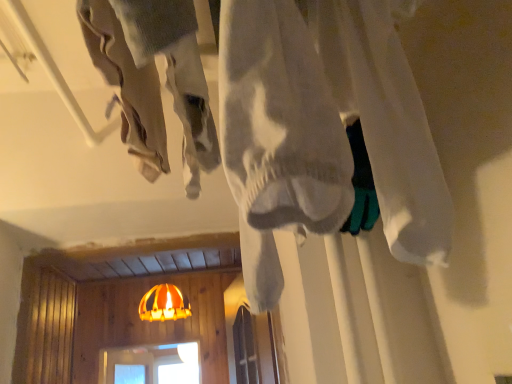
Question: Is orange fabric lampshade at center at the left side of white cotton shirt at center?

Choices:
 (A) yes
 (B) no

Answer: (A)

Question: Considering the relative sizes of orange fabric lampshade at center and white cotton shirt at center in the image provided, is orange fabric lampshade at center wider than white cotton shirt at center?

Choices:
 (A) no
 (B) yes

Answer: (B)

Question: Is orange fabric lampshade at center smaller than white cotton shirt at center?

Choices:
 (A) yes
 (B) no

Answer: (B)

Question: Is orange fabric lampshade at center to the right of white cotton shirt at center from the viewer's perspective?

Choices:
 (A) no
 (B) yes

Answer: (A)

Question: Considering the relative sizes of orange fabric lampshade at center and white cotton shirt at center in the image provided, is orange fabric lampshade at center bigger than white cotton shirt at center?

Choices:
 (A) no
 (B) yes

Answer: (B)

Question: Is orange fabric lampshade at center aimed at white cotton shirt at center?

Choices:
 (A) no
 (B) yes

Answer: (B)

Question: Is white cotton shirt at center oriented away from orange fabric lampshade at center?

Choices:
 (A) no
 (B) yes

Answer: (A)

Question: From the image's perspective, does white cotton shirt at center appear lower than orange fabric lampshade at center?

Choices:
 (A) no
 (B) yes

Answer: (A)

Question: Does white cotton shirt at center have a larger size compared to orange fabric lampshade at center?

Choices:
 (A) no
 (B) yes

Answer: (A)

Question: Is white cotton shirt at center surrounding orange fabric lampshade at center?

Choices:
 (A) yes
 (B) no

Answer: (B)

Question: Is the depth of white cotton shirt at center less than that of orange fabric lampshade at center?

Choices:
 (A) no
 (B) yes

Answer: (B)

Question: Would you say white cotton shirt at center is outside orange fabric lampshade at center?

Choices:
 (A) no
 (B) yes

Answer: (B)

Question: From the image's perspective, is orange fabric lampshade at center above or below white cotton shirt at center?

Choices:
 (A) below
 (B) above

Answer: (A)